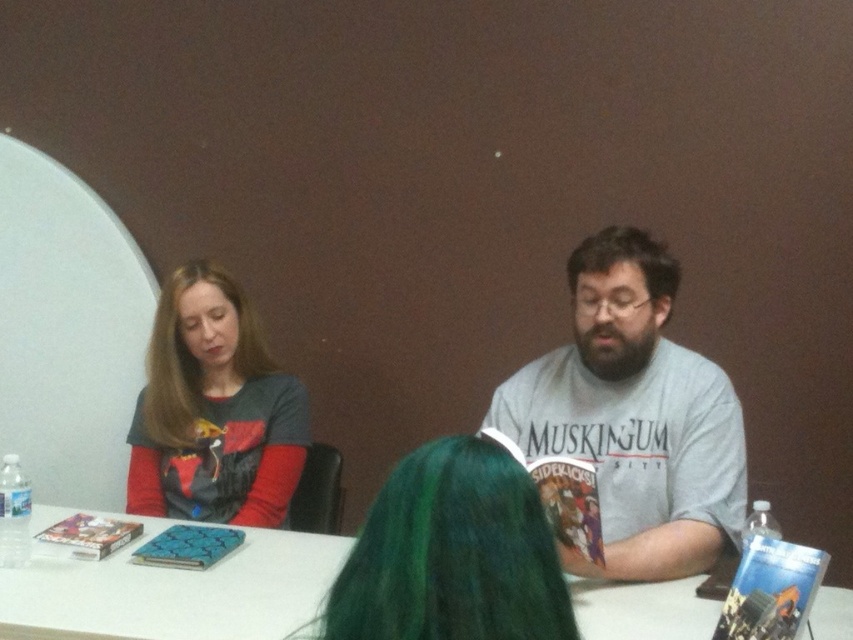
Question: Which point is farther from the camera taking this photo?

Choices:
 (A) (219, 436)
 (B) (706, 365)

Answer: (A)

Question: Which point is farther to the camera?

Choices:
 (A) matte gray sweater at left
 (B) green matte hair at center
 (C) white glossy table at center
 (D) gray cotton shirt at center

Answer: (A)

Question: Can you confirm if gray cotton shirt at center is positioned to the left of green matte hair at center?

Choices:
 (A) no
 (B) yes

Answer: (A)

Question: Estimate the real-world distances between objects in this image. Which object is farther from the matte gray sweater at left?

Choices:
 (A) white glossy table at center
 (B) dark brown hair at center
 (C) green matte hair at center

Answer: (C)

Question: Considering the relative positions of gray cotton shirt at center and dark brown hair at center in the image provided, where is gray cotton shirt at center located with respect to dark brown hair at center?

Choices:
 (A) above
 (B) below

Answer: (B)

Question: Does gray cotton shirt at center come behind matte gray sweater at left?

Choices:
 (A) no
 (B) yes

Answer: (A)